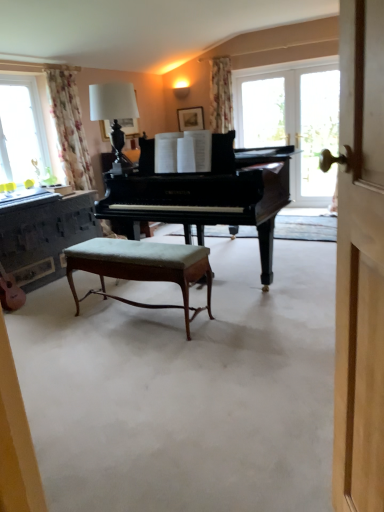
Where is `vacant area that is situated to the right of green fabric stool at center`? This screenshot has height=512, width=384. vacant area that is situated to the right of green fabric stool at center is located at coordinates (234, 310).